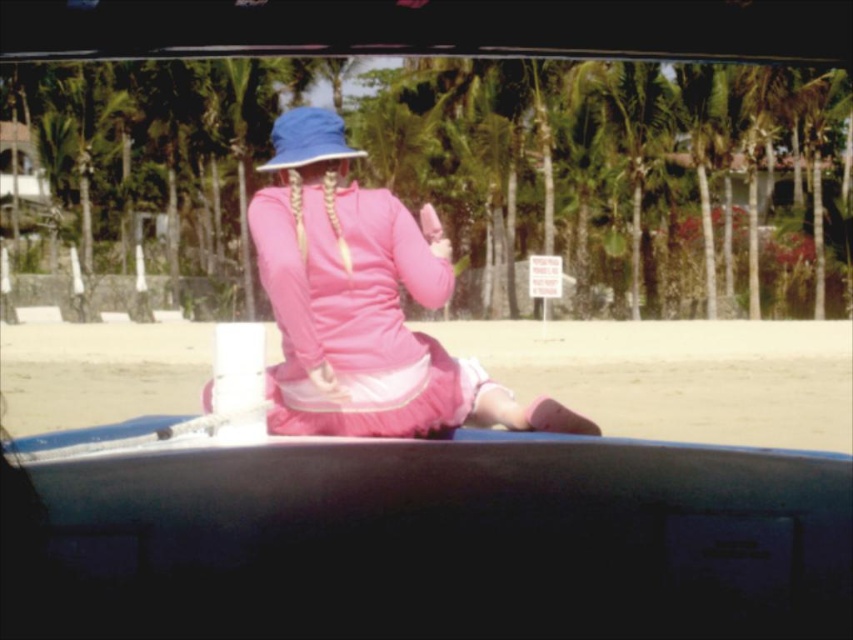
Does blue plastic canoe at center appear on the left side of blue fabric hat at center?

No, blue plastic canoe at center is not to the left of blue fabric hat at center.

Which is in front, point (445, 624) or point (318, 115)?

Point (445, 624) is in front.

Locate an element on the screen. This screenshot has height=640, width=853. blue plastic canoe at center is located at coordinates (453, 536).

Looking at this image, can you confirm if pink fabric skirt at center is positioned to the right of pink matte dress at center?

No, pink fabric skirt at center is not to the right of pink matte dress at center.

Does point (44, 358) come behind point (271, 134)?

No, (44, 358) is closer to viewer.

Where is `pink fabric skirt at center`? Image resolution: width=853 pixels, height=640 pixels. pink fabric skirt at center is located at coordinates (677, 376).

Is pink matte dress at center smaller than blue fabric hat at center?

Indeed, pink matte dress at center has a smaller size compared to blue fabric hat at center.

Image resolution: width=853 pixels, height=640 pixels. What are the coordinates of `pink matte dress at center` in the screenshot? It's located at (363, 305).

What are the coordinates of `pink matte dress at center` in the screenshot? It's located at (363, 305).

Locate an element on the screen. The image size is (853, 640). pink matte dress at center is located at coordinates (363, 305).